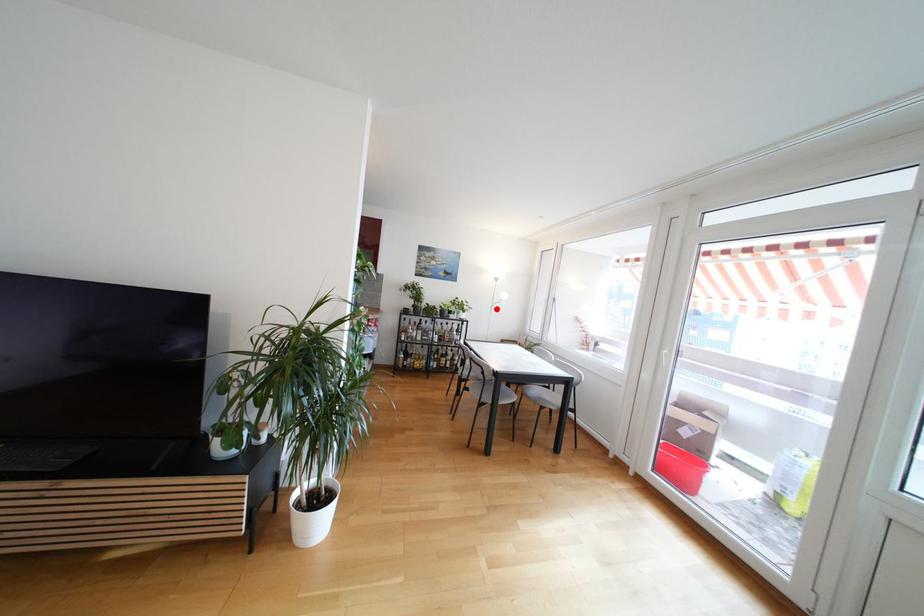
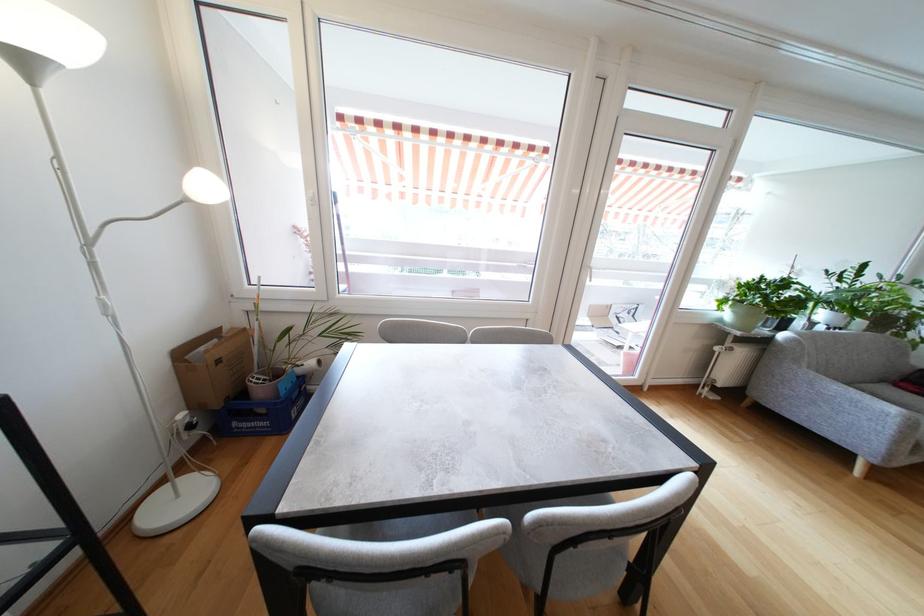
The point at the highlighted location is marked in the first image. Where is the corresponding point in the second image?

(93, 246)